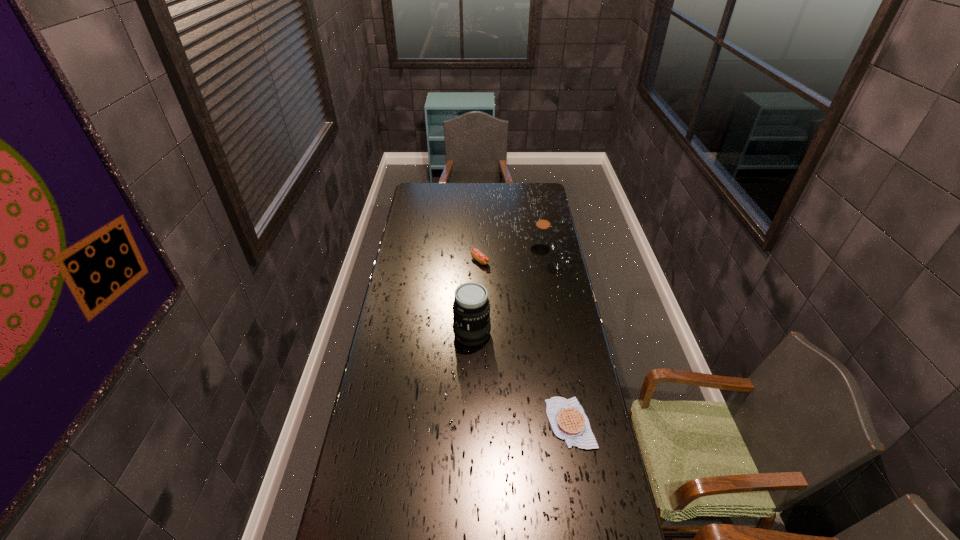
Find the location of `empty space between the telephoto lens and the nearest object`. empty space between the telephoto lens and the nearest object is located at coordinates (521, 378).

The width and height of the screenshot is (960, 540). I want to click on vacant region between the sausage and the second tallest object, so click(510, 255).

Image resolution: width=960 pixels, height=540 pixels. I want to click on free point between the third farthest object and the second tallest object, so click(506, 292).

Where is `object that is the nearest to the second nearest object`? The height and width of the screenshot is (540, 960). object that is the nearest to the second nearest object is located at coordinates (567, 418).

The width and height of the screenshot is (960, 540). In order to click on object that is the third closest to the shortest object in this screenshot , I will do (541, 239).

The width and height of the screenshot is (960, 540). Identify the location of blank space that satisfies the following two spatial constraints: 1. on the front side of the jar; 2. on the right side of the nearest object. (569, 423).

Identify the location of vacant space that satisfies the following two spatial constraints: 1. on the front side of the sausage; 2. on the right side of the nearest object. (480, 423).

Locate an element on the screen. This screenshot has width=960, height=540. vacant region that satisfies the following two spatial constraints: 1. on the back side of the sausage; 2. on the right side of the third shortest object is located at coordinates coord(480,250).